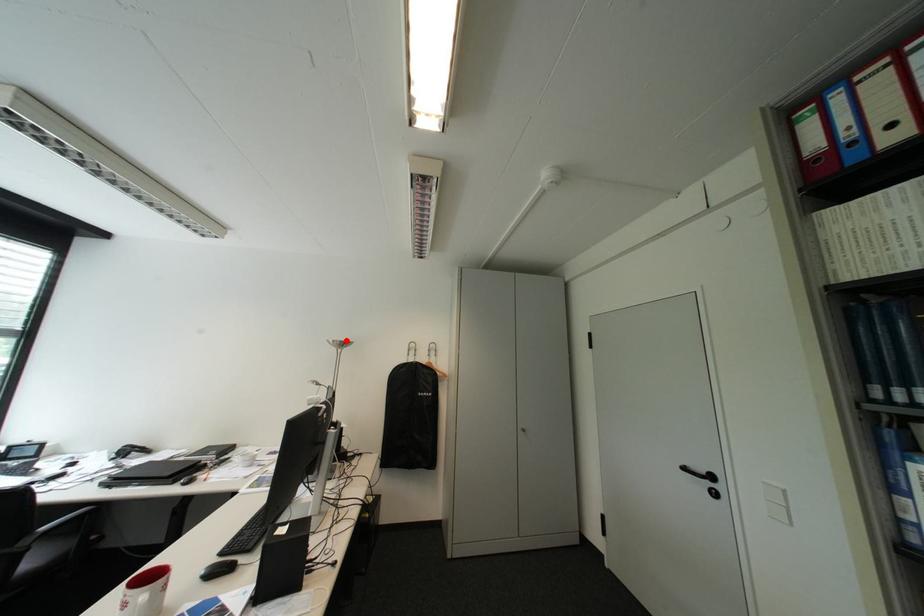
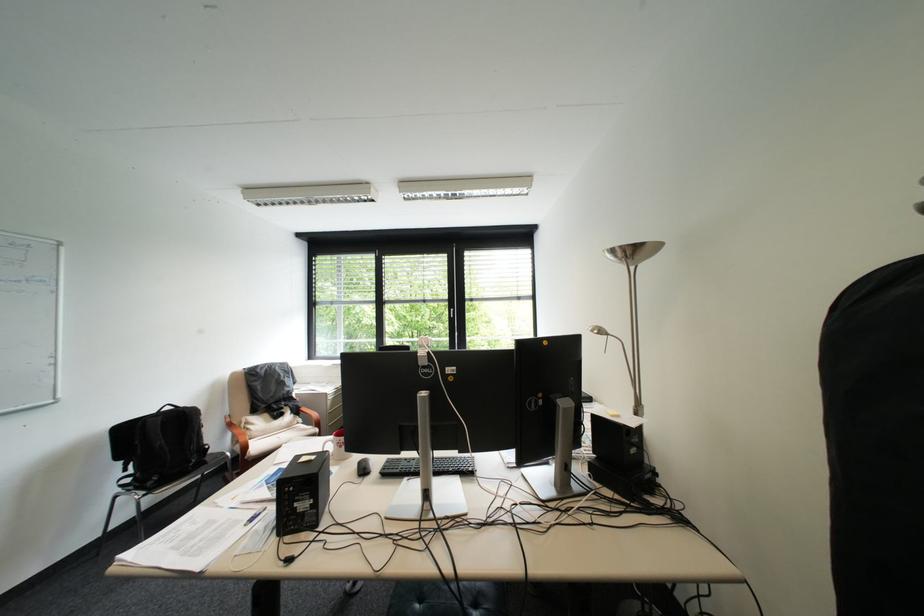
Find the pixel in the second image that matches the highlighted location in the first image.

(625, 252)